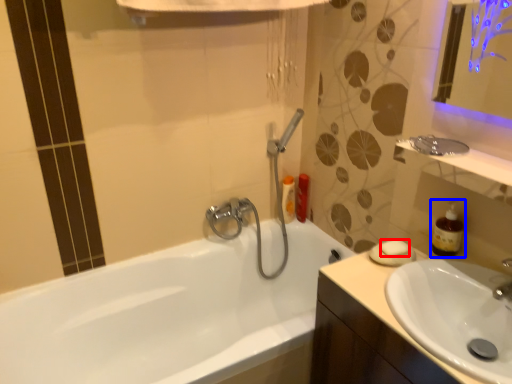
Question: Which of the following is the closest to the observer, soap (highlighted by a red box) or soap dispenser (highlighted by a blue box)?

Choices:
 (A) soap
 (B) soap dispenser

Answer: (B)